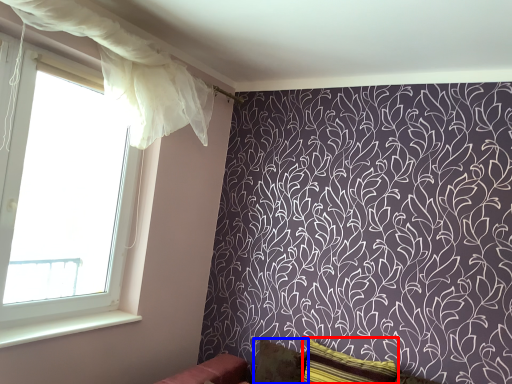
Question: Among these objects, which one is farthest to the camera, pillow (highlighted by a red box) or pillow (highlighted by a blue box)?

Choices:
 (A) pillow
 (B) pillow

Answer: (B)